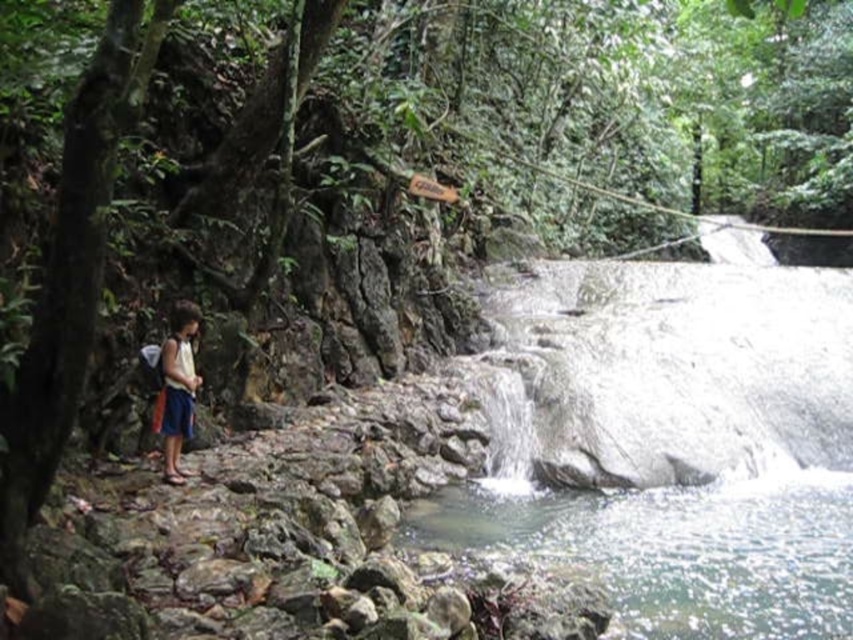
Question: Which point is farther to the camera?

Choices:
 (A) blue denim shorts at left
 (B) clear water at center

Answer: (A)

Question: Does clear water at center appear under blue denim shorts at left?

Choices:
 (A) yes
 (B) no

Answer: (A)

Question: Does clear water at center appear over blue denim shorts at left?

Choices:
 (A) yes
 (B) no

Answer: (B)

Question: Among these objects, which one is farthest from the camera?

Choices:
 (A) blue denim shorts at left
 (B) clear water at center

Answer: (A)

Question: Can you confirm if clear water at center is thinner than blue denim shorts at left?

Choices:
 (A) no
 (B) yes

Answer: (A)

Question: Which of the following is the farthest from the observer?

Choices:
 (A) (834, 612)
 (B) (166, 371)

Answer: (B)